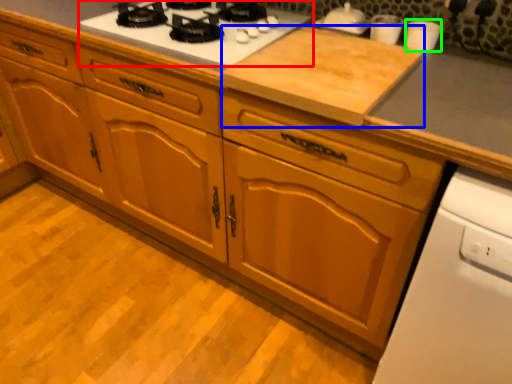
Question: Which is nearer to the gas stove (highlighted by a red box)? plywood (highlighted by a blue box) or appliance (highlighted by a green box).

Choices:
 (A) plywood
 (B) appliance

Answer: (A)